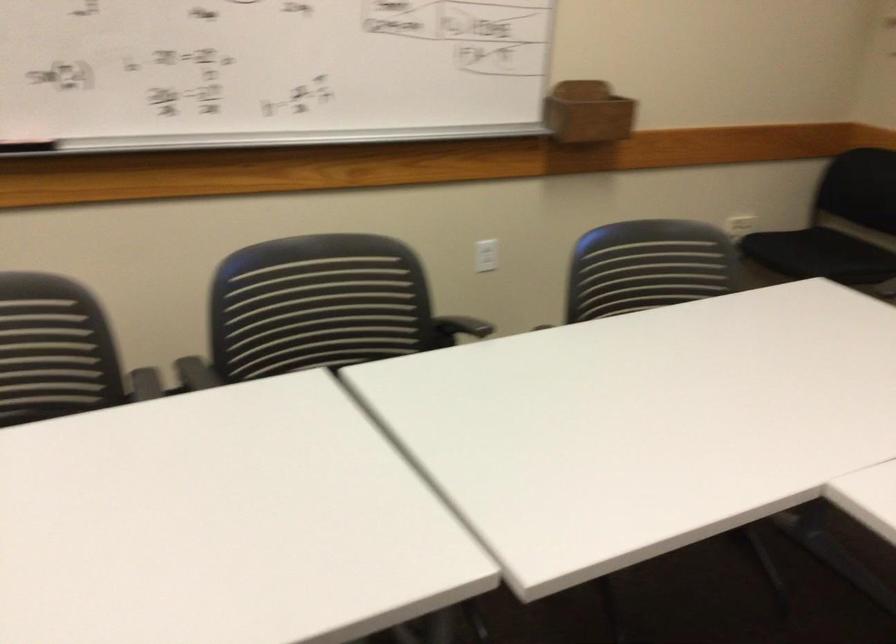
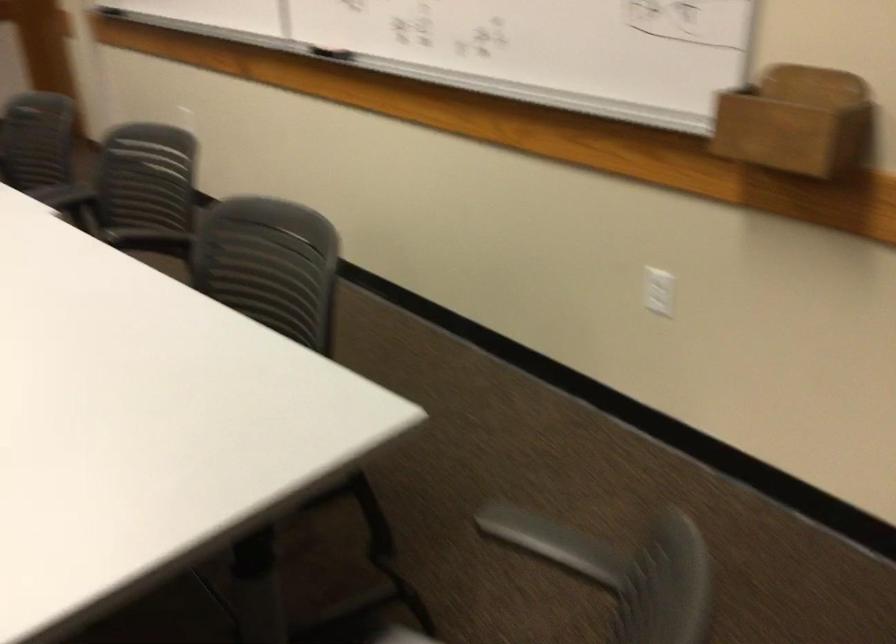
Question: I am providing you with two images of the same scene from different viewpoints. Please identify which objects are invisible in image2.

Choices:
 (A) grey chair armrest
 (B) wooden wall holder
 (C) chair sitting surface
 (D) none of these

Answer: (D)